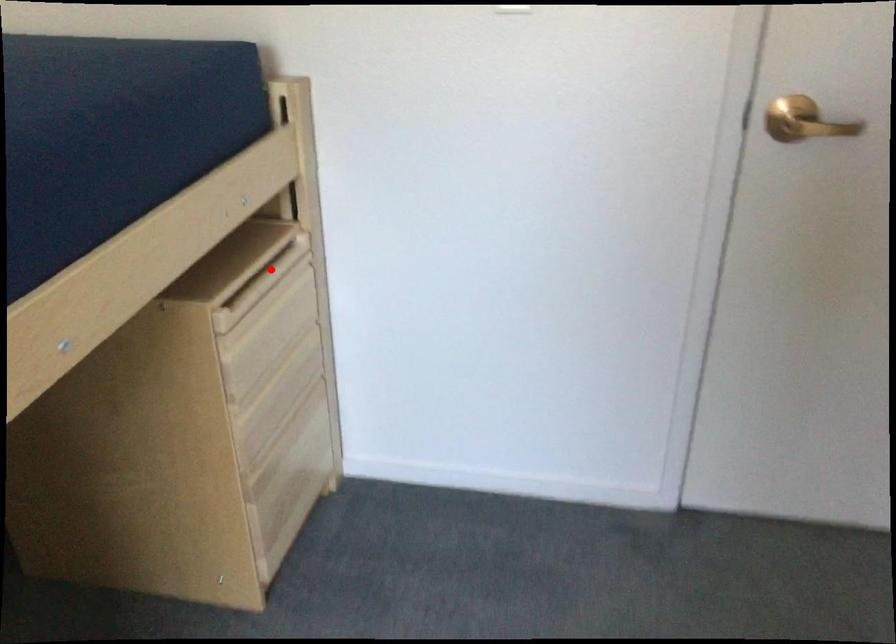
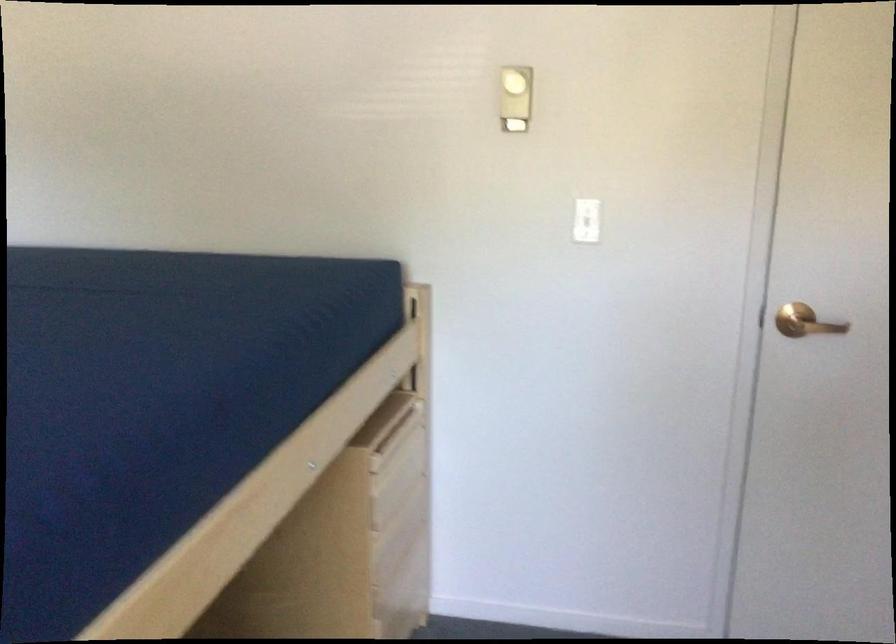
In the second image, find the point that corresponds to the highlighted location in the first image.

(399, 429)